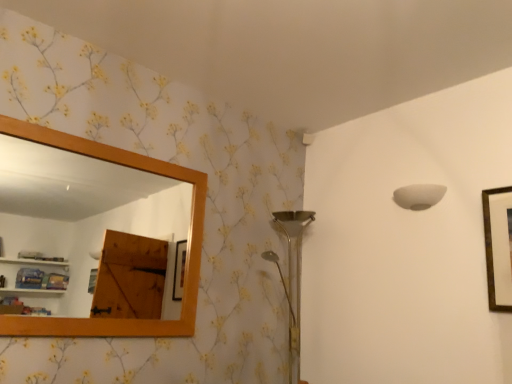
Question: Considering the relative sizes of wooden frame mirror at upper left and gold-framed picture at upper right in the image provided, is wooden frame mirror at upper left thinner than gold-framed picture at upper right?

Choices:
 (A) no
 (B) yes

Answer: (A)

Question: Considering the relative positions of wooden frame mirror at upper left and gold-framed picture at upper right in the image provided, is wooden frame mirror at upper left to the right of gold-framed picture at upper right from the viewer's perspective?

Choices:
 (A) yes
 (B) no

Answer: (B)

Question: Is gold-framed picture at upper right located within wooden frame mirror at upper left?

Choices:
 (A) yes
 (B) no

Answer: (B)

Question: From the image's perspective, would you say wooden frame mirror at upper left is shown under gold-framed picture at upper right?

Choices:
 (A) no
 (B) yes

Answer: (A)

Question: Can you confirm if wooden frame mirror at upper left is taller than gold-framed picture at upper right?

Choices:
 (A) yes
 (B) no

Answer: (A)

Question: From the image's perspective, is gold-framed picture at upper right located above or below white matte lampshade at upper right?

Choices:
 (A) below
 (B) above

Answer: (A)

Question: Do you think gold-framed picture at upper right is within white matte lampshade at upper right, or outside of it?

Choices:
 (A) inside
 (B) outside

Answer: (B)

Question: From a real-world perspective, is gold-framed picture at upper right physically located above or below white matte lampshade at upper right?

Choices:
 (A) above
 (B) below

Answer: (B)

Question: Considering the positions of point (496, 269) and point (406, 188), is point (496, 269) closer or farther from the camera than point (406, 188)?

Choices:
 (A) farther
 (B) closer

Answer: (B)

Question: From a real-world perspective, is white matte lampshade at upper right physically located above or below wooden frame mirror at upper left?

Choices:
 (A) below
 (B) above

Answer: (B)

Question: Do you think white matte lampshade at upper right is within wooden frame mirror at upper left, or outside of it?

Choices:
 (A) inside
 (B) outside

Answer: (B)

Question: Is white matte lampshade at upper right wider or thinner than wooden frame mirror at upper left?

Choices:
 (A) wide
 (B) thin

Answer: (A)

Question: Relative to wooden frame mirror at upper left, is white matte lampshade at upper right in front or behind?

Choices:
 (A) front
 (B) behind

Answer: (B)

Question: In the image, is gold-framed picture at upper right positioned in front of or behind wooden frame mirror at upper left?

Choices:
 (A) front
 (B) behind

Answer: (B)

Question: Is gold-framed picture at upper right inside or outside of wooden frame mirror at upper left?

Choices:
 (A) inside
 (B) outside

Answer: (B)